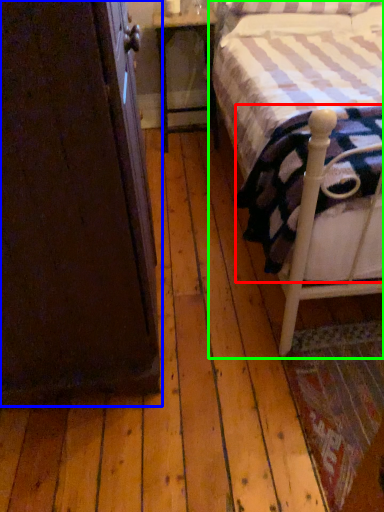
Question: Which object is positioned closest to mattress (highlighted by a red box)? Select from armoire (highlighted by a blue box) and bed (highlighted by a green box).

Choices:
 (A) armoire
 (B) bed

Answer: (B)